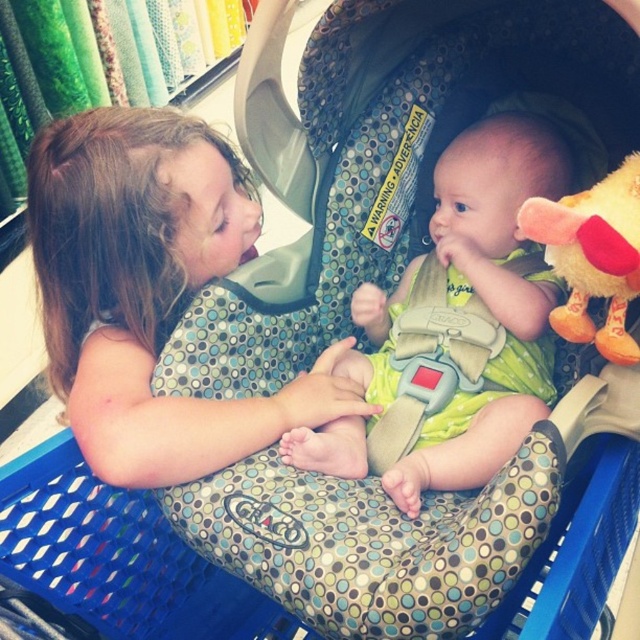
What do you see at coordinates (148, 291) in the screenshot? The width and height of the screenshot is (640, 640). I see `matte green fabric at center` at bounding box center [148, 291].

Between matte green fabric at center and fluffy yellow plush toy at right, which one has less height?

fluffy yellow plush toy at right is shorter.

Is point (147, 294) positioned behind point (573, 266)?

Yes, it is.

Identify the location of matte green fabric at center. The height and width of the screenshot is (640, 640). [x=148, y=291].

Between green polka dot baby car seat at center and fluffy yellow plush toy at right, which one has less height?

Standing shorter between the two is fluffy yellow plush toy at right.

At what (x,y) coordinates should I click in order to perform the action: click on green polka dot baby car seat at center. Please return your answer as a coordinate pair (x, y). The image size is (640, 640). Looking at the image, I should click on (454, 330).

The image size is (640, 640). What do you see at coordinates (148, 291) in the screenshot?
I see `matte green fabric at center` at bounding box center [148, 291].

Does matte green fabric at center appear under green polka dot baby car seat at center?

No.

Is point (115, 177) closer to camera compared to point (538, 364)?

Yes, point (115, 177) is in front of point (538, 364).

This screenshot has width=640, height=640. I want to click on matte green fabric at center, so click(148, 291).